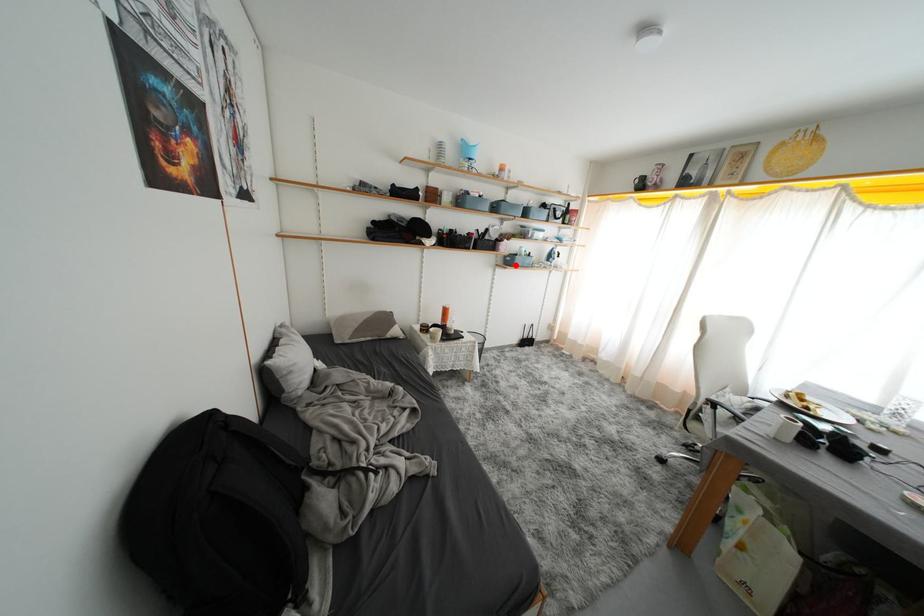
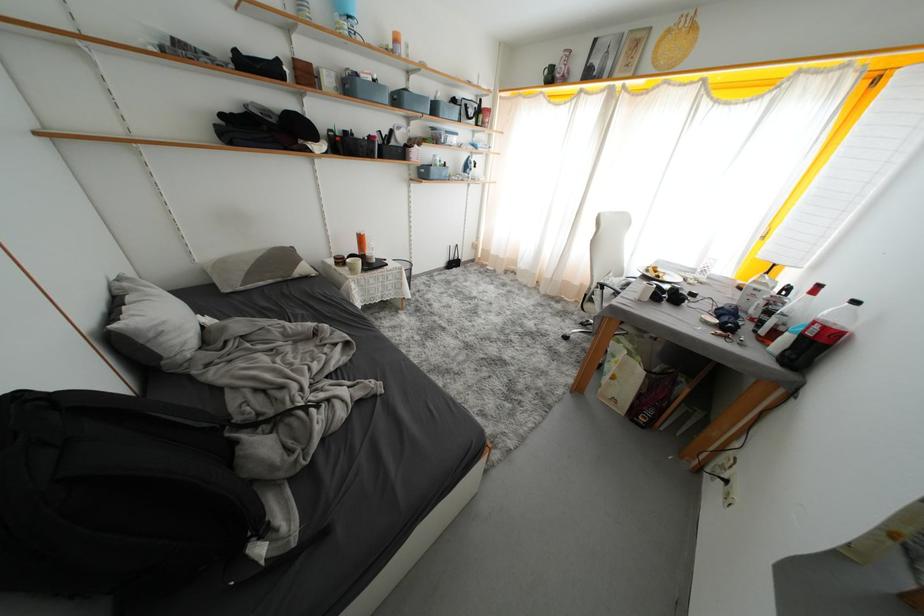
In the second image, find the point that corresponds to the highlighted location in the first image.

(431, 177)